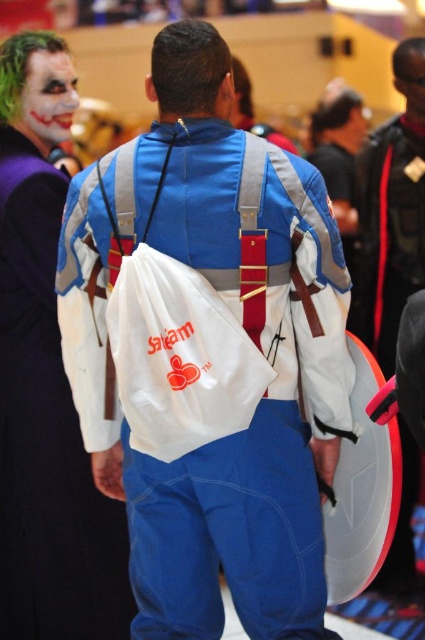
Question: Can you confirm if white fabric backpack at center is positioned below white matte backpack at center?

Choices:
 (A) no
 (B) yes

Answer: (A)

Question: Which point is closer to the camera?

Choices:
 (A) (42, 129)
 (B) (73, 580)
 (C) (413, 99)

Answer: (B)

Question: Which is nearer to the matte clown face at upper left?

Choices:
 (A) white fabric shield at right
 (B) smooth skin face at upper right

Answer: (A)

Question: Which object is the closest to the matte clown face at upper left?

Choices:
 (A) white matte backpack at center
 (B) white fabric backpack at center
 (C) smooth skin face at upper right
 (D) white fabric shield at right

Answer: (A)

Question: Is white fabric backpack at center further to the viewer compared to white fabric shield at right?

Choices:
 (A) yes
 (B) no

Answer: (B)

Question: Can you confirm if white matte backpack at center is positioned below white fabric shield at right?

Choices:
 (A) yes
 (B) no

Answer: (A)